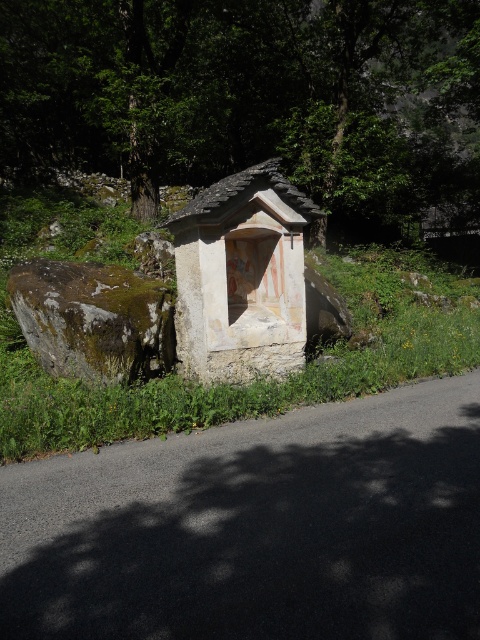
Question: Which is nearer to the white stone shrine at center?

Choices:
 (A) green leafy tree at upper center
 (B) stone wall at center
 (C) green mossy rock at left

Answer: (C)

Question: Which of the following is the farthest from the observer?

Choices:
 (A) (344, 131)
 (B) (453, 330)
 (C) (51, 259)
 (D) (269, 275)

Answer: (A)

Question: Can you confirm if white stone shrine at center is thinner than green mossy rock at left?

Choices:
 (A) no
 (B) yes

Answer: (B)

Question: Can you confirm if green leafy tree at upper center is positioned to the right of stone wall at center?

Choices:
 (A) yes
 (B) no

Answer: (A)

Question: Which object is the farthest from the green mossy rock at left?

Choices:
 (A) white stone shrine at center
 (B) green leafy tree at upper center
 (C) stone wall at center

Answer: (B)

Question: Can you confirm if green leafy tree at upper center is positioned above stone wall at center?

Choices:
 (A) yes
 (B) no

Answer: (A)